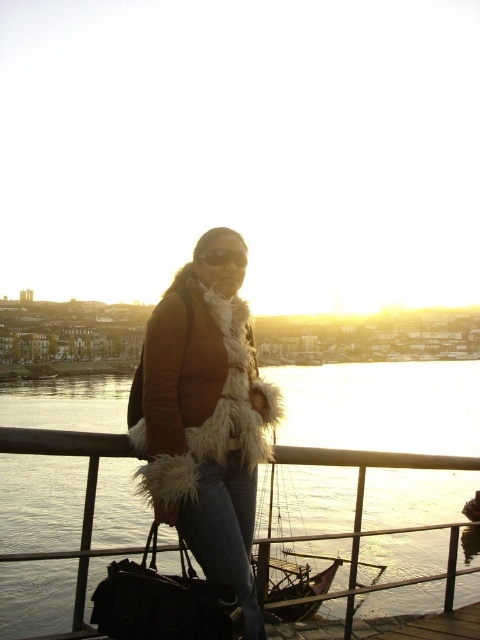
Which of these two, shiny metallic water at center or sunglasses at center, stands shorter?

sunglasses at center is shorter.

You are a GUI agent. You are given a task and a screenshot of the screen. Output one action in this format:
    pyautogui.click(x=<x>, y=<y>)
    Task: Click on the shiny metallic water at center
    
    Given the screenshot: What is the action you would take?
    pyautogui.click(x=382, y=404)

Is shiny metallic water at center bigger than black leather bag at lower left?

Correct, shiny metallic water at center is larger in size than black leather bag at lower left.

The image size is (480, 640). What do you see at coordinates (382, 404) in the screenshot? I see `shiny metallic water at center` at bounding box center [382, 404].

Between point (296, 481) and point (235, 620), which one is positioned in front?

Positioned in front is point (235, 620).

Where is `shiny metallic water at center`? shiny metallic water at center is located at coordinates (382, 404).

Between black leather bag at lower left and sunglasses at center, which one is positioned lower?

Positioned lower is black leather bag at lower left.

Between black leather bag at lower left and sunglasses at center, which one appears on the left side from the viewer's perspective?

black leather bag at lower left is more to the left.

The image size is (480, 640). Find the location of `black leather bag at lower left`. black leather bag at lower left is located at coordinates (163, 602).